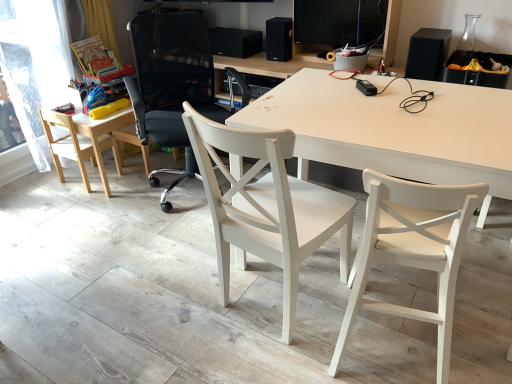
Identify the location of vacant area in front of black mesh office chair at center, which is the third chair in right-to-left order. Image resolution: width=512 pixels, height=384 pixels. (155, 244).